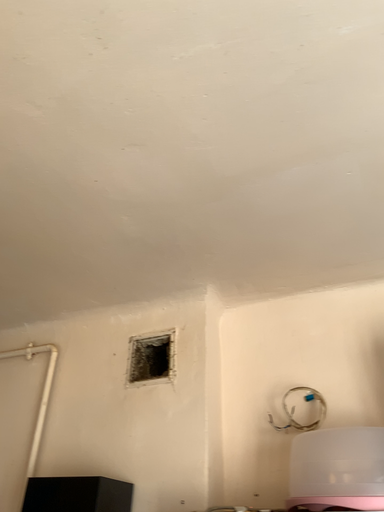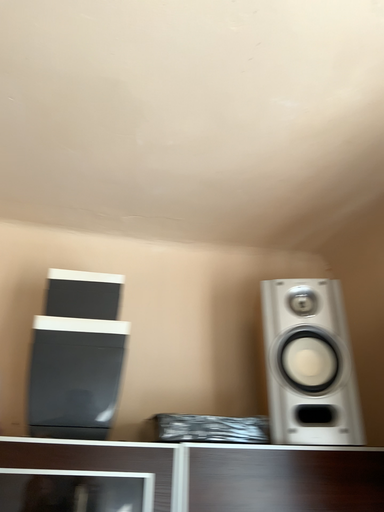
Question: How did the camera likely rotate when shooting the video?

Choices:
 (A) rotated left
 (B) rotated right

Answer: (B)